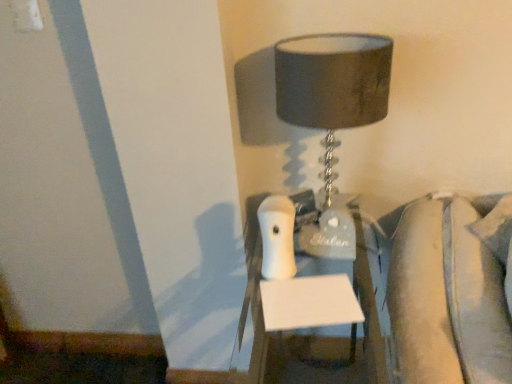
Question: Considering the positions of point (335, 208) and point (285, 271), is point (335, 208) closer or farther from the camera than point (285, 271)?

Choices:
 (A) closer
 (B) farther

Answer: (B)

Question: Considering the positions of matte gray lampshade at upper center and white glossy nightstand at center in the image, is matte gray lampshade at upper center wider or thinner than white glossy nightstand at center?

Choices:
 (A) wide
 (B) thin

Answer: (B)

Question: Is matte gray lampshade at upper center in front of or behind white glossy nightstand at center in the image?

Choices:
 (A) front
 (B) behind

Answer: (B)

Question: From their relative heights in the image, would you say white glossy nightstand at center is taller or shorter than matte gray lampshade at upper center?

Choices:
 (A) tall
 (B) short

Answer: (A)

Question: Is white glossy nightstand at center to the left or to the right of matte gray lampshade at upper center in the image?

Choices:
 (A) right
 (B) left

Answer: (A)

Question: Considering the positions of point (312, 286) and point (374, 69), is point (312, 286) closer or farther from the camera than point (374, 69)?

Choices:
 (A) farther
 (B) closer

Answer: (A)

Question: Is white glossy nightstand at center in front of or behind matte gray lampshade at upper center in the image?

Choices:
 (A) front
 (B) behind

Answer: (A)